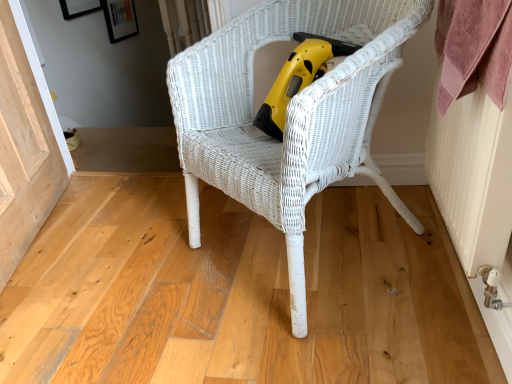
Question: Is white wicker chair at center in front of or behind natural wood screen door at lower left in the image?

Choices:
 (A) behind
 (B) front

Answer: (B)

Question: Does point (279, 19) appear closer or farther from the camera than point (12, 264)?

Choices:
 (A) closer
 (B) farther

Answer: (A)

Question: Which is nearer to the white wicker chair at center?

Choices:
 (A) natural wood screen door at lower left
 (B) yellow plastic vacuum at center

Answer: (B)

Question: Considering the real-world distances, which object is closest to the yellow plastic vacuum at center?

Choices:
 (A) white wicker chair at center
 (B) natural wood screen door at lower left

Answer: (A)